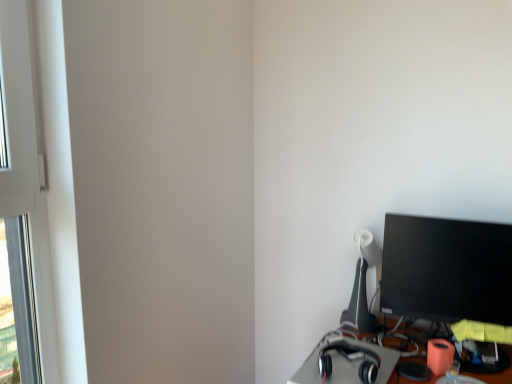
At what (x,y) coordinates should I click in order to perform the action: click on free spot below satin black headphones at lower right (from a real-world perspective). Please return your answer as a coordinate pair (x, y). Image resolution: width=512 pixels, height=384 pixels. Looking at the image, I should click on (345, 369).